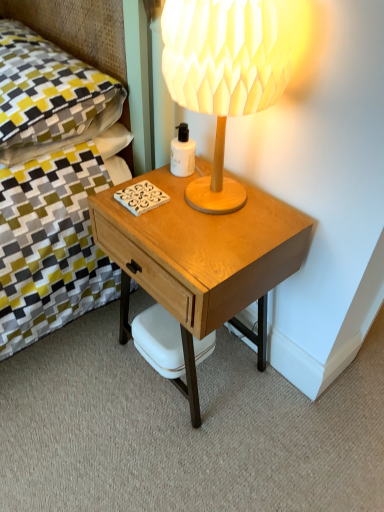
Identify the location of free location above light brown wood desk at center (from a real-world perspective). This screenshot has height=512, width=384. (198, 212).